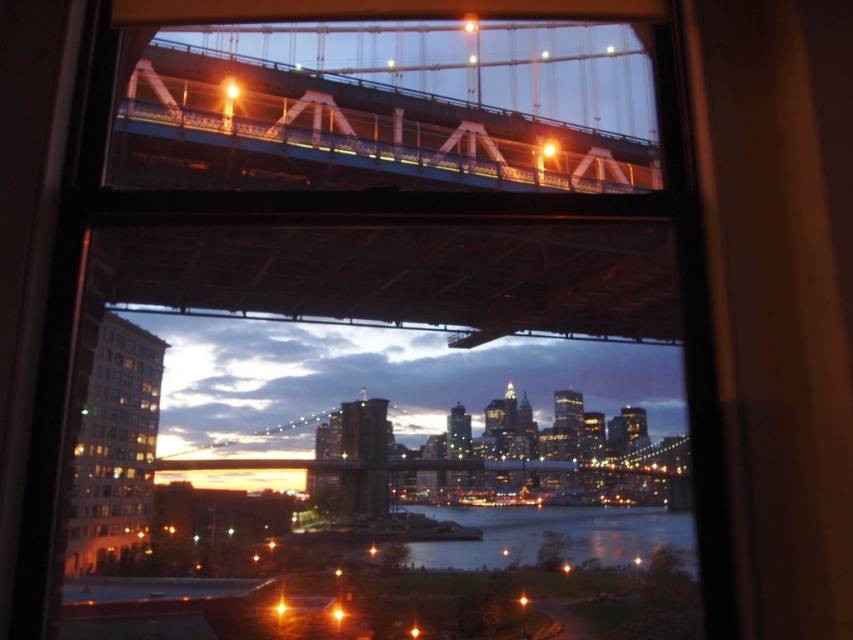
Which of these two, matte glass building at lower left or dark blue water at center, stands shorter?

dark blue water at center

Between point (102, 532) and point (538, 536), which one is positioned in front?

Point (102, 532)

In order to click on matte glass building at lower left in this screenshot , I will do `click(115, 444)`.